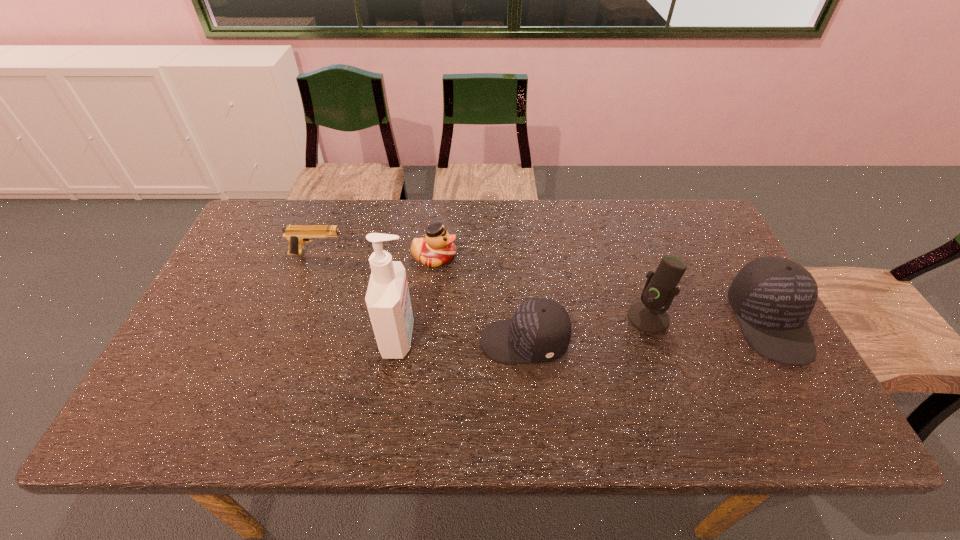
Locate an element on the screen. free space at the far edge of the desktop is located at coordinates (492, 227).

Locate an element on the screen. The width and height of the screenshot is (960, 540). vacant space at the near edge is located at coordinates (624, 366).

Locate an element on the screen. This screenshot has height=540, width=960. vacant point at the right edge is located at coordinates (724, 318).

This screenshot has width=960, height=540. Identify the location of free space at the far left corner. (278, 234).

This screenshot has height=540, width=960. Identify the location of free space at the far right corner of the desktop. (718, 242).

This screenshot has width=960, height=540. Find the location of `free space between the third object from right to left and the cleansing agent`. free space between the third object from right to left and the cleansing agent is located at coordinates (462, 340).

Locate an element on the screen. free space between the rightmost object and the duck is located at coordinates (602, 290).

The height and width of the screenshot is (540, 960). In order to click on free space between the tallest object and the pistol in this screenshot , I will do `click(358, 296)`.

This screenshot has width=960, height=540. I want to click on unoccupied area between the pistol and the left baseball cap, so click(x=420, y=298).

Locate an element on the screen. vacant point located between the fifth object from left to right and the right baseball cap is located at coordinates point(708,320).